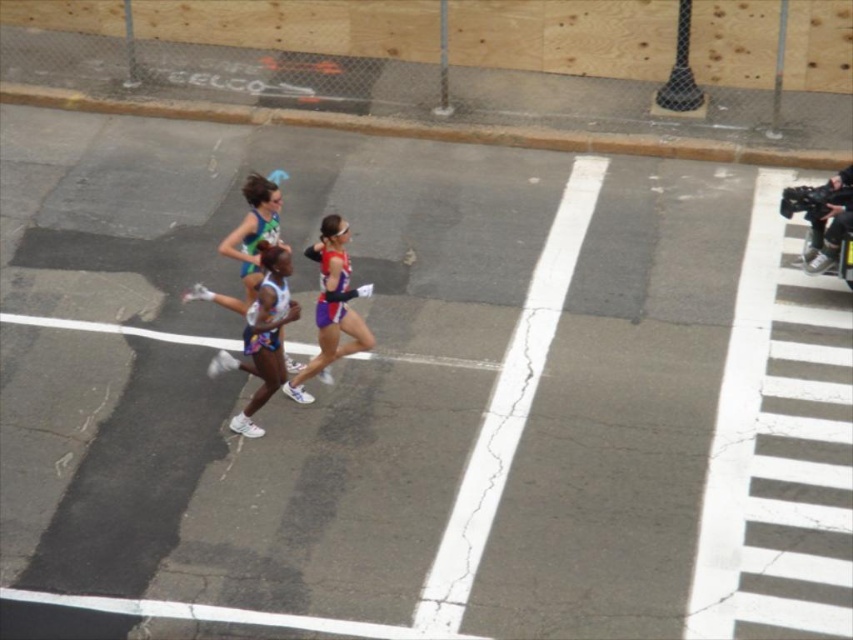
The height and width of the screenshot is (640, 853). What do you see at coordinates (262, 336) in the screenshot?
I see `white athletic wear at center` at bounding box center [262, 336].

Who is more distant from viewer, (274, 365) or (291, 369)?

Positioned behind is point (291, 369).

Where is `white athletic wear at center`? Image resolution: width=853 pixels, height=640 pixels. white athletic wear at center is located at coordinates (262, 336).

Which of these two, white athletic wear at center or shiny purple shorts at center, stands shorter?

With less height is shiny purple shorts at center.

This screenshot has width=853, height=640. What are the coordinates of `white athletic wear at center` in the screenshot? It's located at (262, 336).

Who is more distant from viewer, (x=325, y=285) or (x=241, y=253)?

The point (x=241, y=253) is behind.

Can you confirm if shiny purple shorts at center is bigger than shiny blue tank top at center?

Yes.

I want to click on shiny purple shorts at center, so click(331, 307).

Where is `shiny purple shorts at center`? Image resolution: width=853 pixels, height=640 pixels. shiny purple shorts at center is located at coordinates (331, 307).